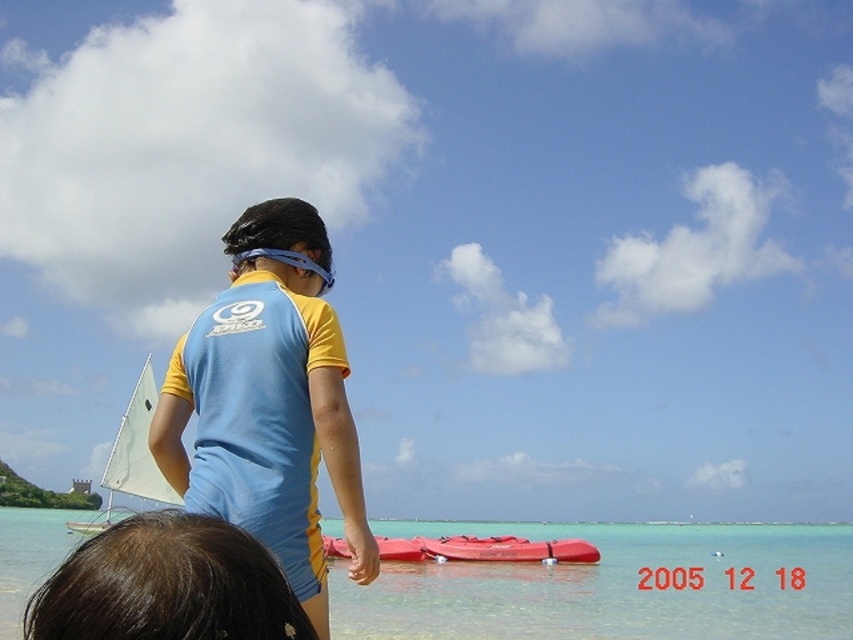
You are a photographer trying to capture the white matte sail at upper left and the blue rubber goggles at upper center in the same frame. Based on their positions, which object should you focus on first to ensure both are in the shot?

The white matte sail at upper left is below the blue rubber goggles at upper center, so you should focus on the blue rubber goggles at upper center first to ensure both are in the frame.

You are a photographer standing at the camera position. You want to capture a photo of the white matte sail at upper left. Given that your camera has a maximum focus range of 200 feet, will you be able to focus on the sail?

The white matte sail at upper left and camera are 202.41 feet apart from each other. Since the maximum focus range is 200 feet, the sail is slightly out of range, so the camera cannot focus on it.

You are a swimmer who wants to reach the white matte sail at upper left from the rubberized red kayak at center. Given that you can swim at a speed of 1.5 meters per minute, how many minutes will it take you to reach the sail?

The white matte sail at upper left is 24.21 meters away from the rubberized red kayak at center. At a swimming speed of 1.5 meters per minute, it would take approximately 16.14 minutes to reach the sail.